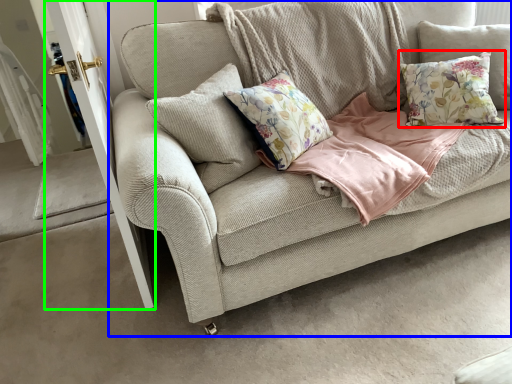
Question: Which is nearer to the pillow (highlighted by a red box)? studio couch (highlighted by a blue box) or screen door (highlighted by a green box).

Choices:
 (A) studio couch
 (B) screen door

Answer: (A)